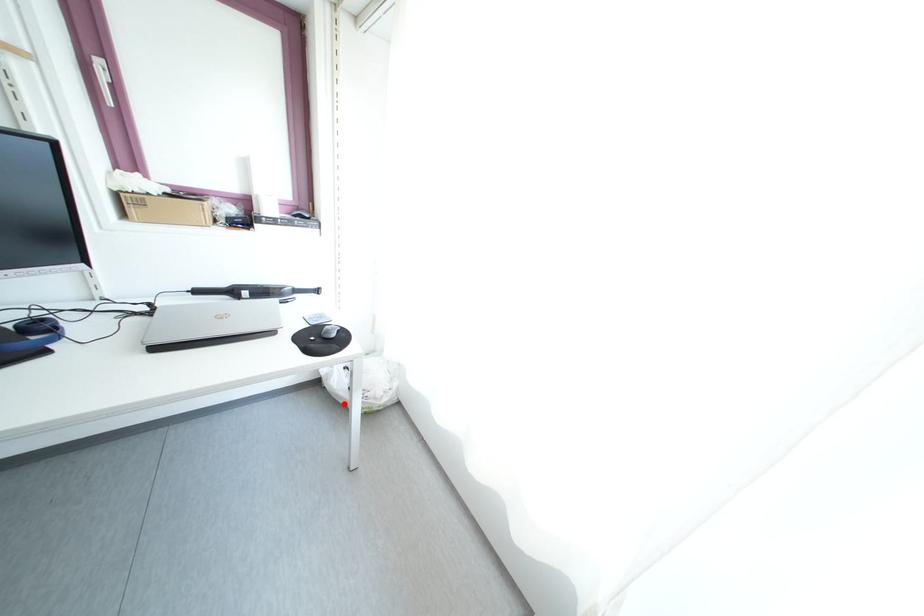
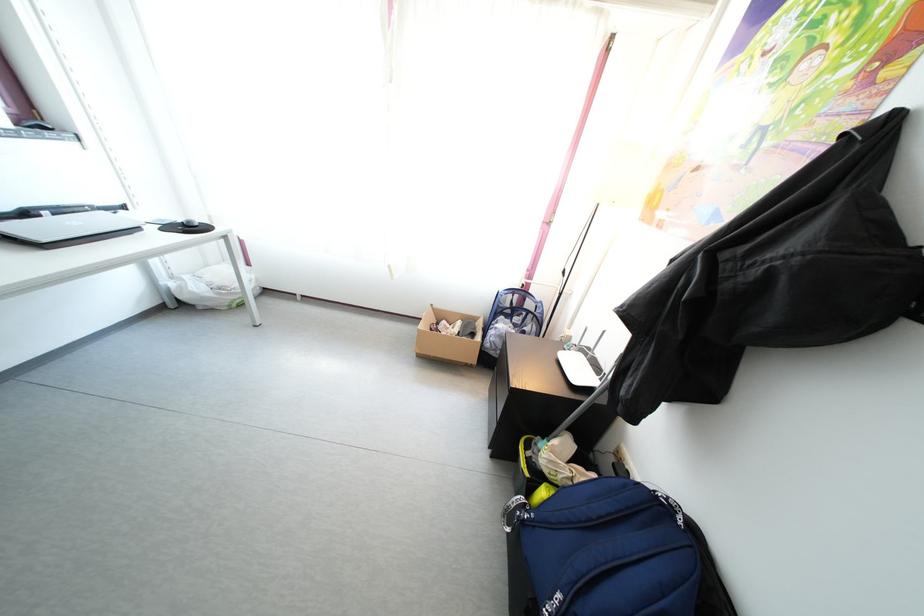
Question: I am providing you with two images of the same scene from different viewpoints. Given a red point in image1, look at the same physical point in image2. Is it:

Choices:
 (A) Closer to the viewpoint
 (B) Farther from the viewpoint

Answer: (A)